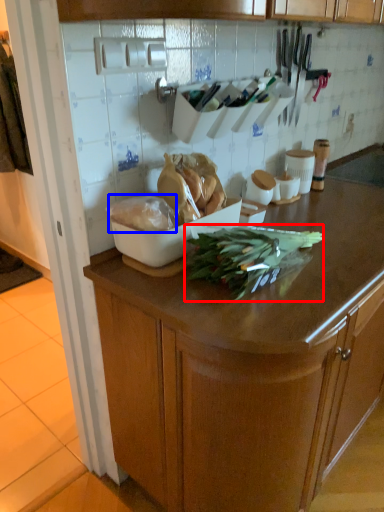
Question: Which point is closer to the camera, green vegetables (highlighted by a red box) or food (highlighted by a blue box)?

Choices:
 (A) green vegetables
 (B) food

Answer: (A)